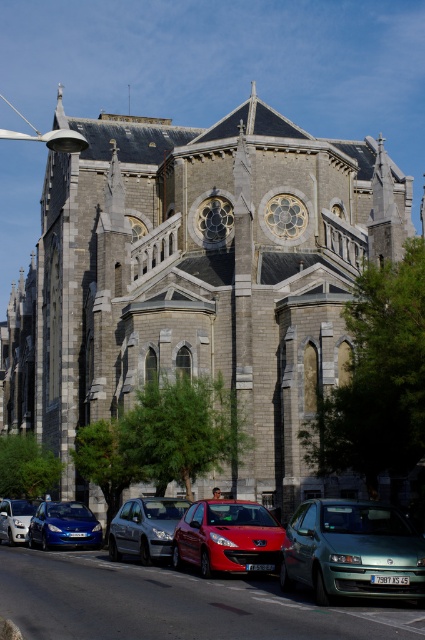
Question: Which point is farther to the camera?

Choices:
 (A) (16, 524)
 (B) (229, 556)
 (C) (36, 532)
 (D) (317, 515)

Answer: (A)

Question: Does gray stone church at center have a smaller size compared to metallic green sedan at lower right?

Choices:
 (A) yes
 (B) no

Answer: (B)

Question: Estimate the real-world distances between objects in this image. Which object is farther from the silver metallic car at center?

Choices:
 (A) gray stone church at center
 (B) silver metallic car at lower left
 (C) metallic green sedan at lower right

Answer: (A)

Question: Is matte blue car at lower left wider than silver metallic car at lower left?

Choices:
 (A) yes
 (B) no

Answer: (A)

Question: Is metallic green sedan at lower right below shiny red car at center?

Choices:
 (A) no
 (B) yes

Answer: (A)

Question: Among these points, which one is farthest from the camera?

Choices:
 (A) (147, 186)
 (B) (220, 532)
 (C) (172, 531)

Answer: (A)